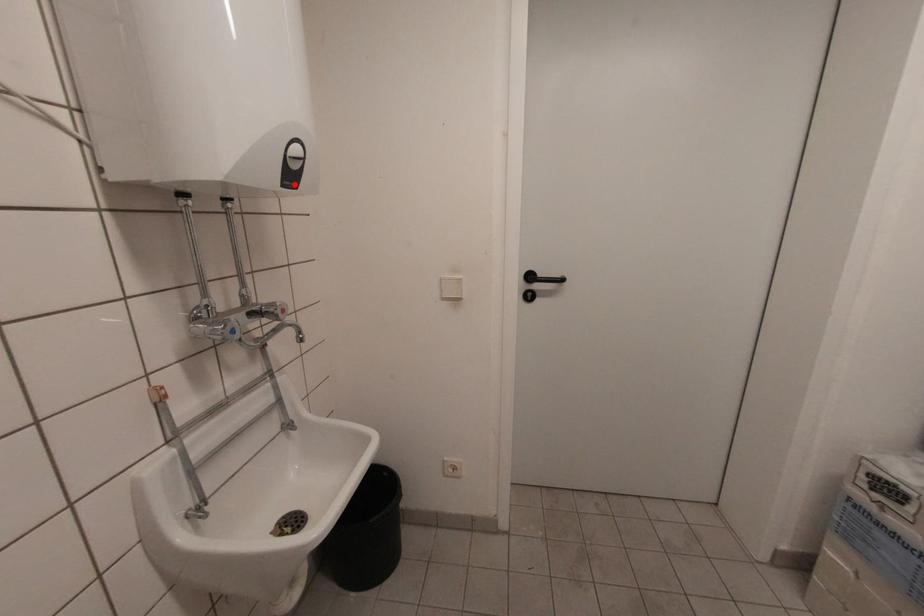
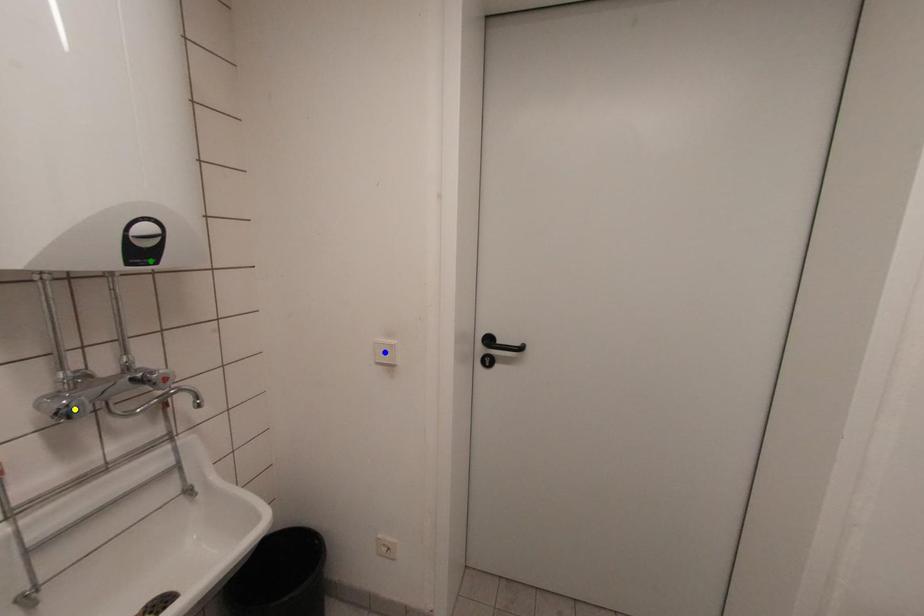
Question: I am providing you with two images of the same scene from different viewpoints. A red point is marked on the first image. You are given multiple points on the second image. Which spot in image 2 lines up with the point in image 1?

Choices:
 (A) green point
 (B) blue point
 (C) yellow point

Answer: (A)